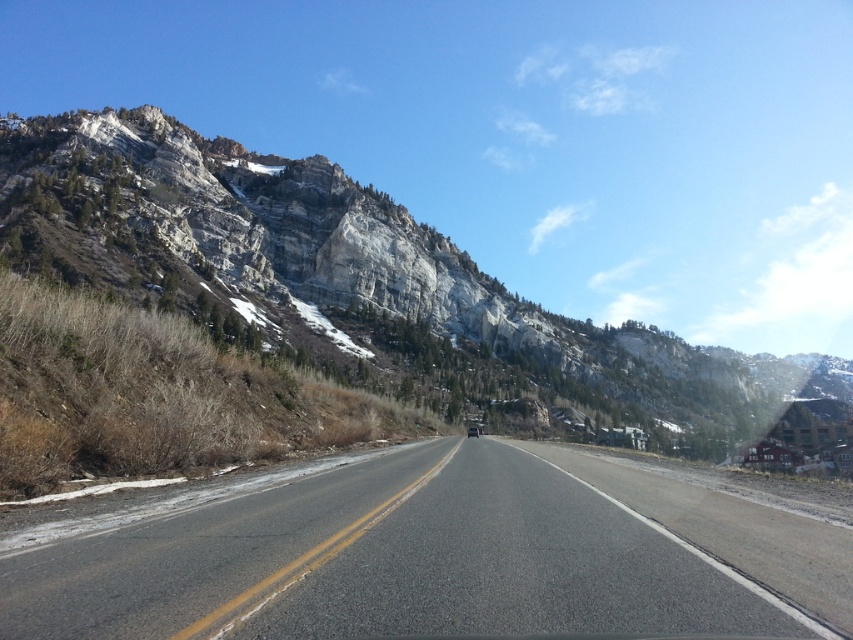
You are a driver approaching the rocky cliff at upper left and the asphalt road at center. Which object is taller from your viewpoint?

The rocky cliff at upper left is taller than the asphalt road at center.

You are driving along the two lane road and you see two points marked on the road ahead. The first point is at coordinate point (532, 566) and the second is at point (735, 420). Which point is closer to your current position?

Point (532, 566) is closer to the viewer than point (735, 420), so the first point is closer to your current position.

You are driving along the asphalt road at center and notice a rocky cliff at upper left. Which object is higher in elevation?

The rocky cliff at upper left is higher in elevation than the asphalt road at center because the asphalt road at center is below the rocky cliff at upper left.